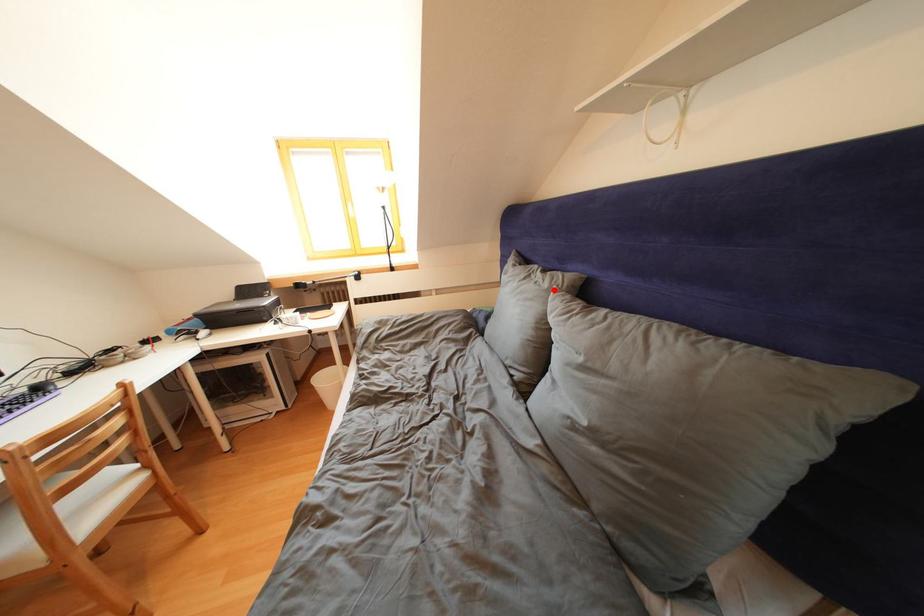
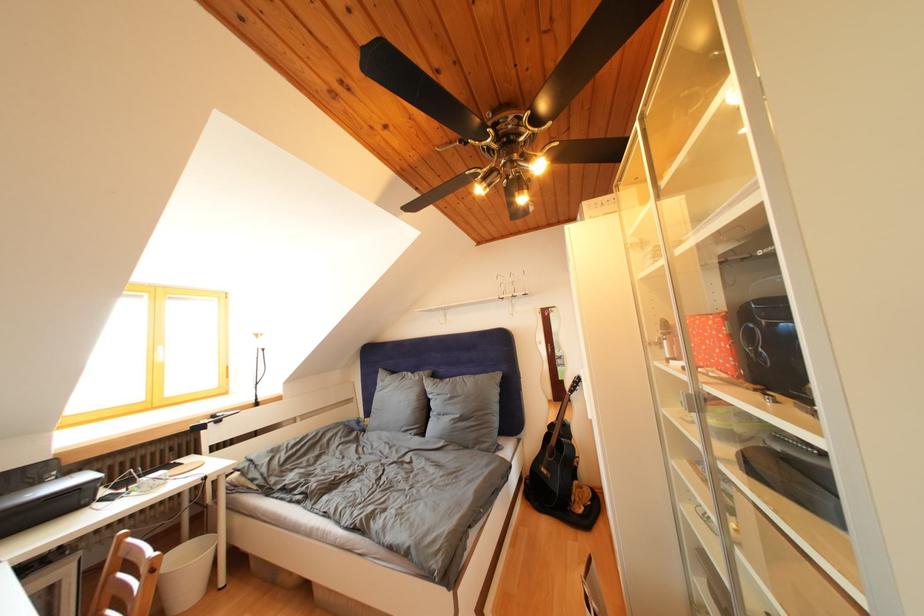
In the second image, find the point that corresponds to the highlighted location in the first image.

(426, 383)